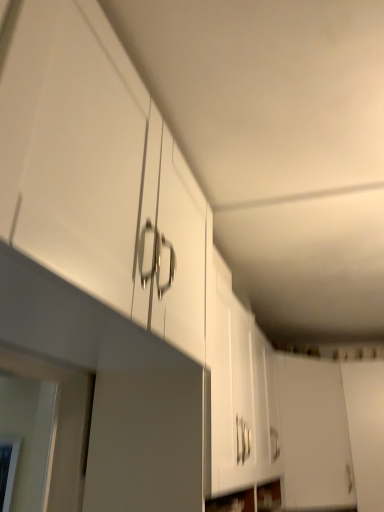
Question: Considering the positions of point (370, 429) and point (344, 428), is point (370, 429) closer or farther from the camera than point (344, 428)?

Choices:
 (A) farther
 (B) closer

Answer: (B)

Question: In terms of size, does white matte door at lower right, acting as the 2th door starting from the left, appear bigger or smaller than white matte cabinet door at lower right, the first door positioned from the left?

Choices:
 (A) small
 (B) big

Answer: (A)

Question: Estimate the real-world distances between objects in this image. Which object is closer to the white matte cabinet door at lower right, the first door positioned from the left?

Choices:
 (A) white matte door at lower right, arranged as the first door when viewed from the right
 (B) white glossy cabinet at upper left

Answer: (A)

Question: Which object is the farthest from the white glossy cabinet at upper left?

Choices:
 (A) white matte door at lower right, arranged as the first door when viewed from the right
 (B) white matte cabinet door at lower right, positioned as the 2th door in right-to-left order

Answer: (A)